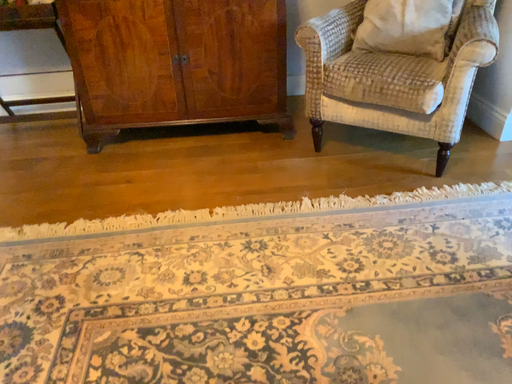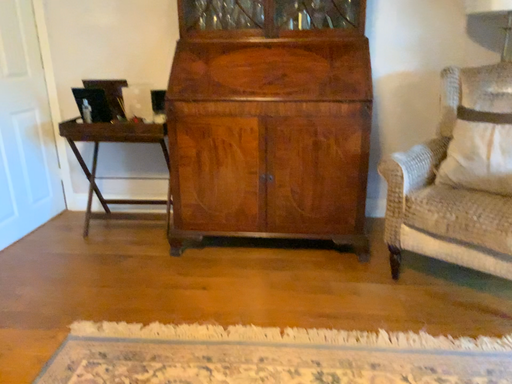
Question: Which way did the camera rotate in the video?

Choices:
 (A) rotated downward
 (B) rotated upward

Answer: (B)